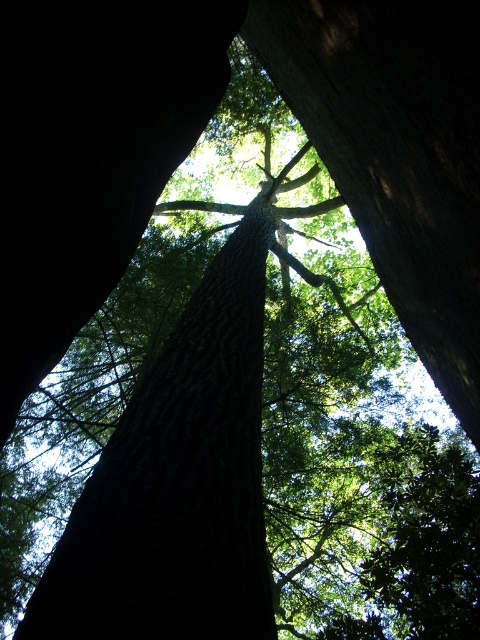
Question: Which point is closer to the camera taking this photo?

Choices:
 (A) (308, 60)
 (B) (220, 444)

Answer: (B)

Question: Can you confirm if dark brown rough tree trunk at center is bigger than dark brown textured tree trunk at center?

Choices:
 (A) yes
 (B) no

Answer: (B)

Question: Is dark brown rough tree trunk at center smaller than dark brown textured tree trunk at center?

Choices:
 (A) yes
 (B) no

Answer: (A)

Question: Which point is closer to the camera taking this photo?

Choices:
 (A) (262, 307)
 (B) (338, 161)

Answer: (B)

Question: Does dark brown rough tree trunk at center appear under dark brown textured tree trunk at center?

Choices:
 (A) no
 (B) yes

Answer: (B)